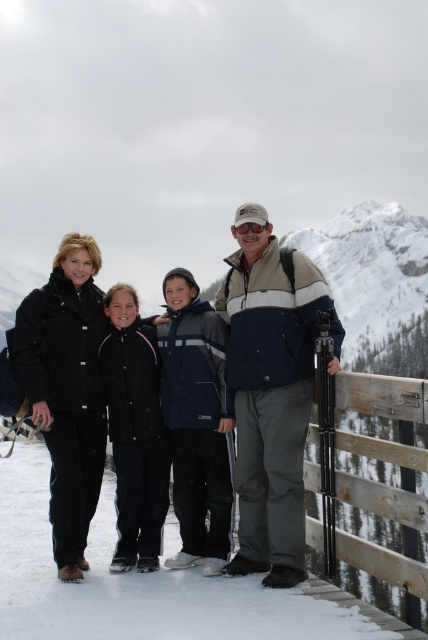
You are a photographer trying to capture a photo of the group standing at point (x=290, y=435) and point (x=181, y=376). Based on their positions, which point will appear larger in the photo?

Point (x=290, y=435) is closer to the camera than point (x=181, y=376), so it will appear larger in the photo.

You are part of the group in the snowy landscape. You need to locate the matte blue jacket at center and the navy blue jacket at center. Which one is positioned to the right?

The matte blue jacket at center is to the right of the navy blue jacket at center.

You are planning to take a group photo of the two adults wearing dark blue jacket at center and navy blue jacket at center. Which adult should stand at the back to ensure both are fully visible in the photo?

The dark blue jacket at center is much taller than the navy blue jacket at center, so the adult wearing the dark blue jacket at center should stand at the back to ensure both are fully visible in the photo.